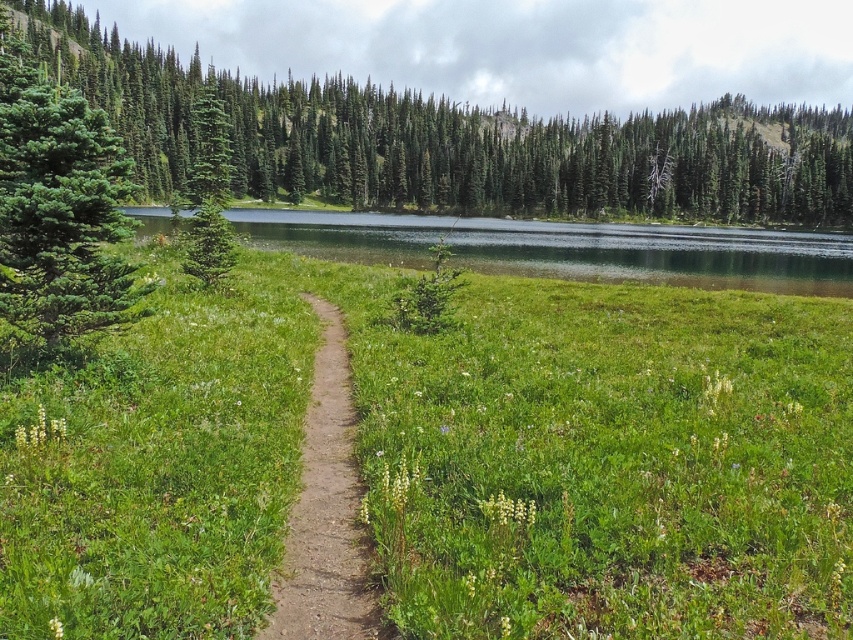
Can you confirm if green textured pine tree at center is positioned above dirt path at center?

Yes, green textured pine tree at center is above dirt path at center.

Does green textured pine tree at center have a lesser width compared to dirt path at center?

In fact, green textured pine tree at center might be wider than dirt path at center.

Between point (488, 195) and point (355, 550), which one is positioned behind?

The point (488, 195) is more distant.

Identify the location of green textured pine tree at center. (537, 156).

Which is behind, point (738, 216) or point (67, 184)?

The point (738, 216) is behind.

Between green textured pine tree at center and green matte tree at left, which one is positioned higher?

Positioned higher is green textured pine tree at center.

Does point (135, 150) come closer to viewer compared to point (9, 112)?

No.

This screenshot has height=640, width=853. Find the location of `green textured pine tree at center`. green textured pine tree at center is located at coordinates (537, 156).

Who is positioned more to the right, green textured pine tree at center or green grassy lake at center?

From the viewer's perspective, green textured pine tree at center appears more on the right side.

What do you see at coordinates (537, 156) in the screenshot? The image size is (853, 640). I see `green textured pine tree at center` at bounding box center [537, 156].

The height and width of the screenshot is (640, 853). Identify the location of green textured pine tree at center. (537, 156).

The image size is (853, 640). Identify the location of green textured pine tree at center. (537, 156).